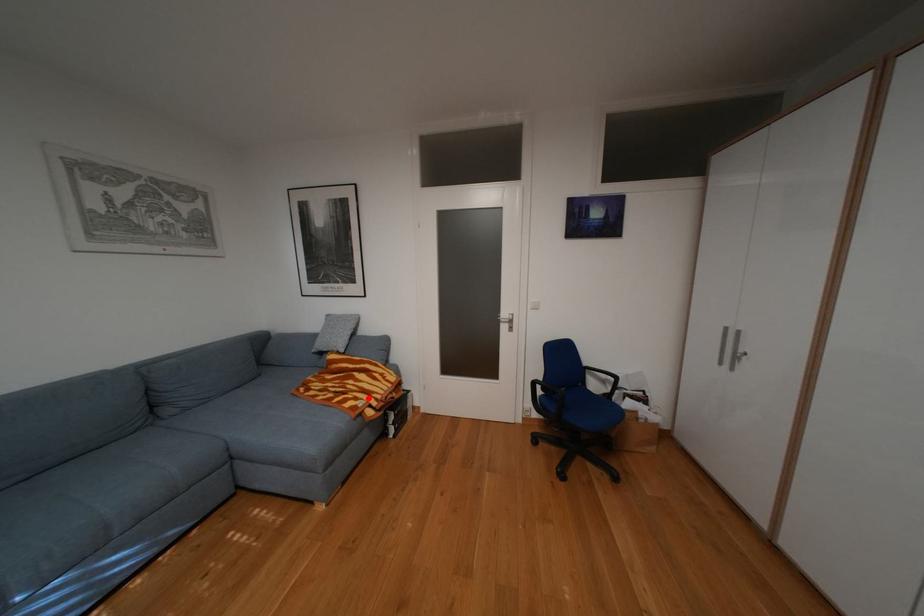
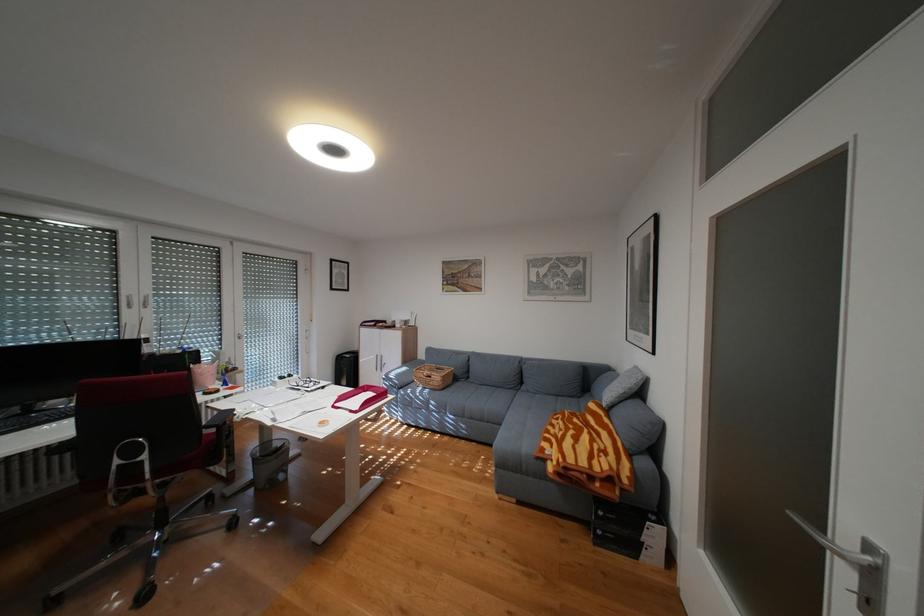
The point at the highlighted location is marked in the first image. Where is the corresponding point in the second image?

(564, 445)